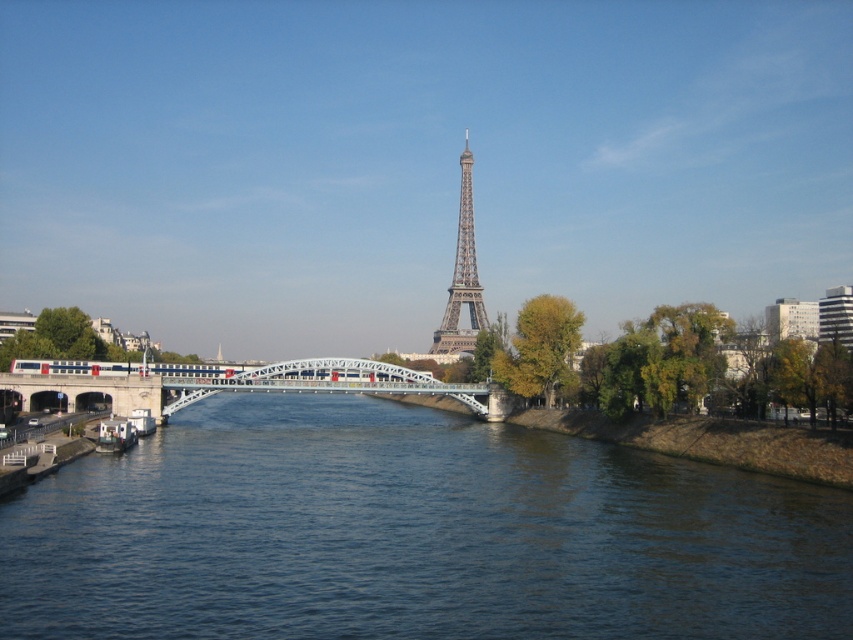
Question: Is blue water at center to the left of metallic lattice tower at center from the viewer's perspective?

Choices:
 (A) yes
 (B) no

Answer: (A)

Question: Is blue water at center closer to camera compared to metallic lattice tower at center?

Choices:
 (A) yes
 (B) no

Answer: (A)

Question: Which of these objects is positioned closest to the blue water at center?

Choices:
 (A) metallic bridge at center
 (B) metallic lattice tower at center

Answer: (A)

Question: Is blue water at center to the right of metallic bridge at center from the viewer's perspective?

Choices:
 (A) yes
 (B) no

Answer: (A)

Question: Which of the following is the closest to the observer?

Choices:
 (A) blue water at center
 (B) metallic bridge at center
 (C) metallic lattice tower at center

Answer: (A)

Question: Which of the following is the farthest from the observer?

Choices:
 (A) (460, 225)
 (B) (293, 384)

Answer: (A)